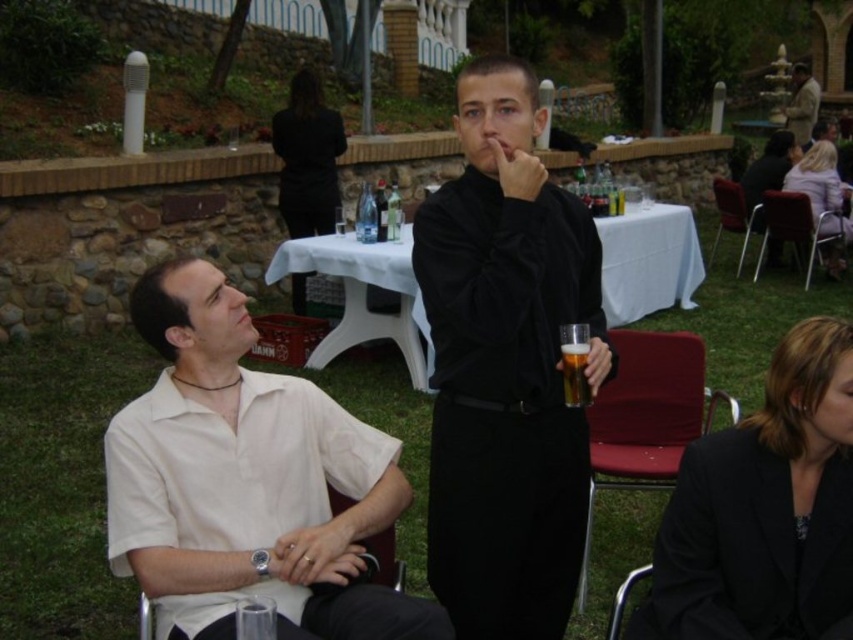
Does black fabric jacket at lower right appear under metallic silver chair at center?

Yes.

Is black fabric jacket at lower right thinner than metallic silver chair at center?

No.

Is point (704, 502) positioned in front of point (758, 224)?

Yes, point (704, 502) is in front of point (758, 224).

The height and width of the screenshot is (640, 853). In order to click on black fabric jacket at lower right in this screenshot , I will do `click(764, 509)`.

Is point (769, 609) positioned before point (286, 163)?

Yes, point (769, 609) is closer to viewer.

I want to click on black fabric jacket at lower right, so click(764, 509).

Looking at this image, which of these two, metallic silver chair at center or metallic silver chair at lower right, stands taller?

metallic silver chair at center

Is metallic silver chair at center below metallic silver chair at lower right?

Answer: Actually, metallic silver chair at center is above metallic silver chair at lower right.

Is point (717, 240) in front of point (618, 628)?

That is False.

Where is `metallic silver chair at center`? metallic silver chair at center is located at coordinates (734, 216).